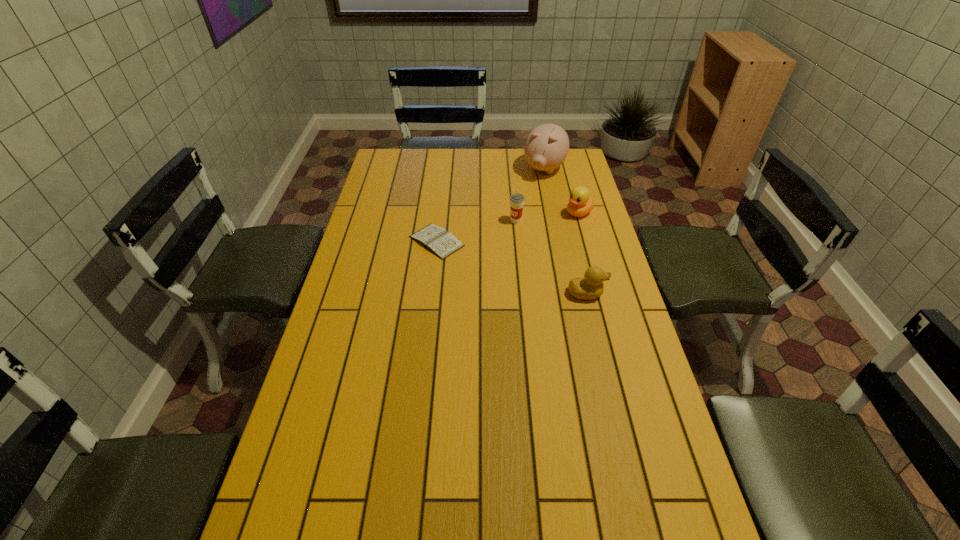
Locate an element on the screen. The image size is (960, 540). object present at the far right corner is located at coordinates (546, 147).

Where is `vacant space at the far edge of the desktop`? This screenshot has height=540, width=960. vacant space at the far edge of the desktop is located at coordinates (500, 156).

At what (x,y) coordinates should I click in order to perform the action: click on vacant space at the near edge of the desktop. Please return your answer as a coordinate pair (x, y). Image resolution: width=960 pixels, height=540 pixels. Looking at the image, I should click on (516, 516).

In the image, there is a desktop. Where is `free space at the left edge`? free space at the left edge is located at coordinates (389, 279).

Locate an element on the screen. This screenshot has width=960, height=540. blank space at the right edge is located at coordinates (611, 390).

The image size is (960, 540). Identify the location of vacant space at the far left corner of the desktop. (380, 159).

The width and height of the screenshot is (960, 540). Identify the location of vacant region between the diary and the tallest object. (491, 206).

I want to click on free space between the farthest object and the fourth shortest object, so click(530, 195).

Where is `vacant area between the farther duckling and the nearer duckling`? This screenshot has height=540, width=960. vacant area between the farther duckling and the nearer duckling is located at coordinates (583, 253).

Locate an element on the screen. Image resolution: width=960 pixels, height=540 pixels. free space that is in between the farthest object and the diary is located at coordinates (491, 206).